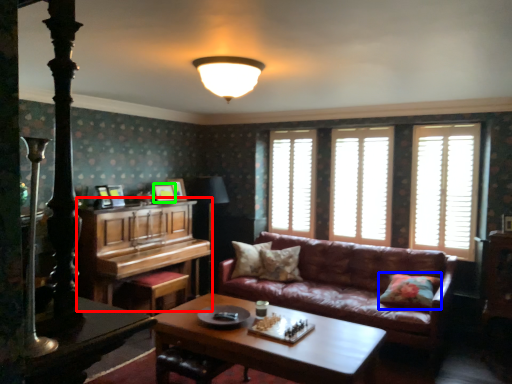
Question: Which is farther away from piano (highlighted by a red box)? pillow (highlighted by a blue box) or picture frame (highlighted by a green box)?

Choices:
 (A) pillow
 (B) picture frame

Answer: (A)